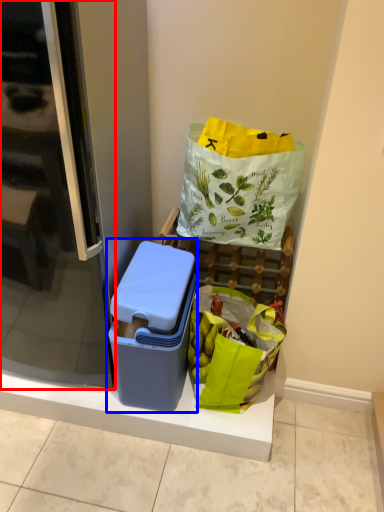
Question: Among these objects, which one is farthest to the camera, screen door (highlighted by a red box) or lunch box (highlighted by a blue box)?

Choices:
 (A) screen door
 (B) lunch box

Answer: (B)